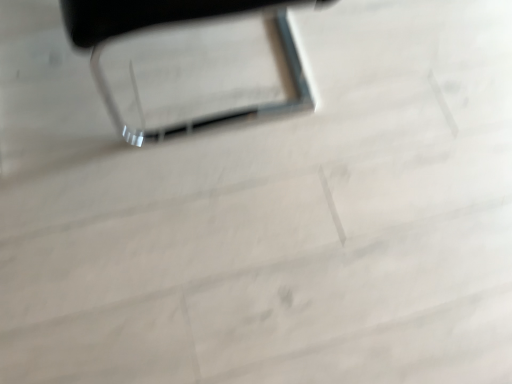
The width and height of the screenshot is (512, 384). I want to click on unoccupied region to the right of clear acrylic stand at upper center, so click(379, 169).